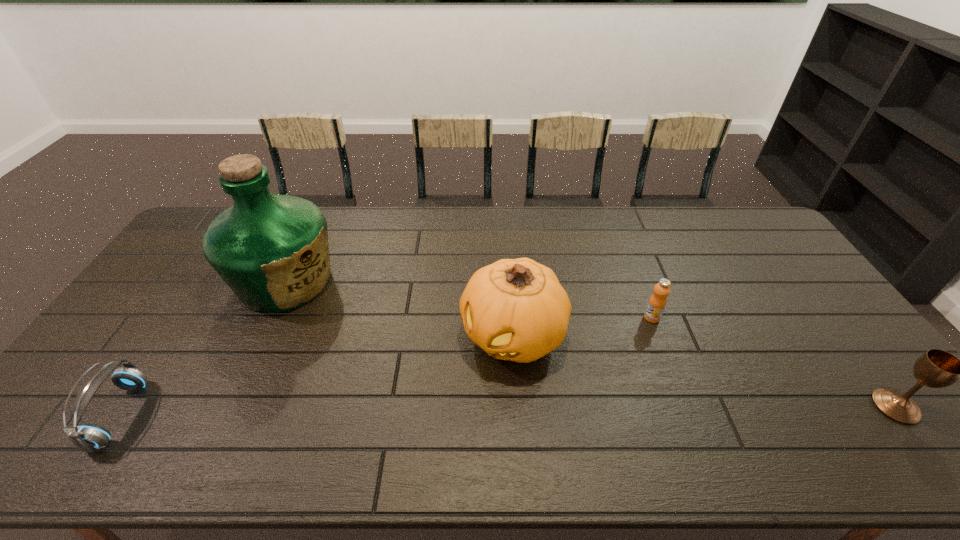
I want to click on vacant space on the desktop that is between the leftmost object and the rightmost object and is positioned on the front label of the fourth object from left to right, so click(546, 410).

Where is `free space on the desktop that is between the leftmost object and the chalice and is positioned on the label side of the tallest object`? Image resolution: width=960 pixels, height=540 pixels. free space on the desktop that is between the leftmost object and the chalice and is positioned on the label side of the tallest object is located at coordinates (465, 411).

Where is `free space on the desktop that is between the headset and the third tallest object and is positioned on the front face of the third object from left to right`? The image size is (960, 540). free space on the desktop that is between the headset and the third tallest object and is positioned on the front face of the third object from left to right is located at coordinates (434, 411).